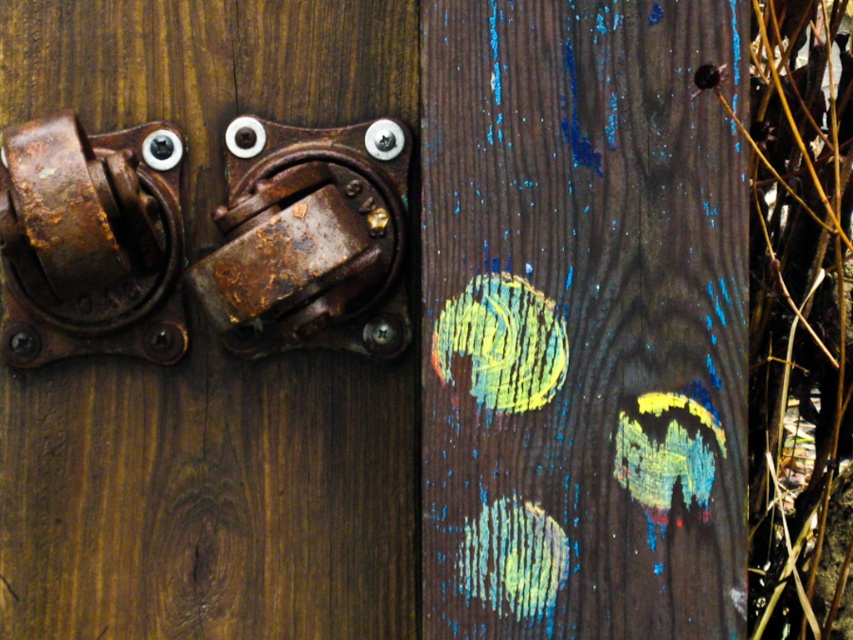
Which is above, wooden plank with paint splatters at center or rusty metal door handle at left?

rusty metal door handle at left is above.

Is wooden plank with paint splatters at center taller than rusty metal door handle at left?

Correct, wooden plank with paint splatters at center is much taller as rusty metal door handle at left.

Measure the distance between point (450, 376) and camera.

Point (450, 376) and camera are 3.66 feet apart.

Find the location of `wooden plank with paint splatters at center`. wooden plank with paint splatters at center is located at coordinates (581, 321).

Is the position of rusty metal door handle at center less distant than that of rusty metal door handle at left?

No.

Which is in front, point (231, 257) or point (102, 260)?

Point (102, 260)

Locate an element on the screen. The height and width of the screenshot is (640, 853). rusty metal door handle at center is located at coordinates (308, 240).

Does wooden plank with paint splatters at center appear on the right side of rusty metal door handle at center?

Indeed, wooden plank with paint splatters at center is positioned on the right side of rusty metal door handle at center.

The height and width of the screenshot is (640, 853). What do you see at coordinates (581, 321) in the screenshot? I see `wooden plank with paint splatters at center` at bounding box center [581, 321].

Does point (526, 586) come farther from viewer compared to point (256, 228)?

Yes, it is.

The image size is (853, 640). Find the location of `wooden plank with paint splatters at center`. wooden plank with paint splatters at center is located at coordinates (581, 321).